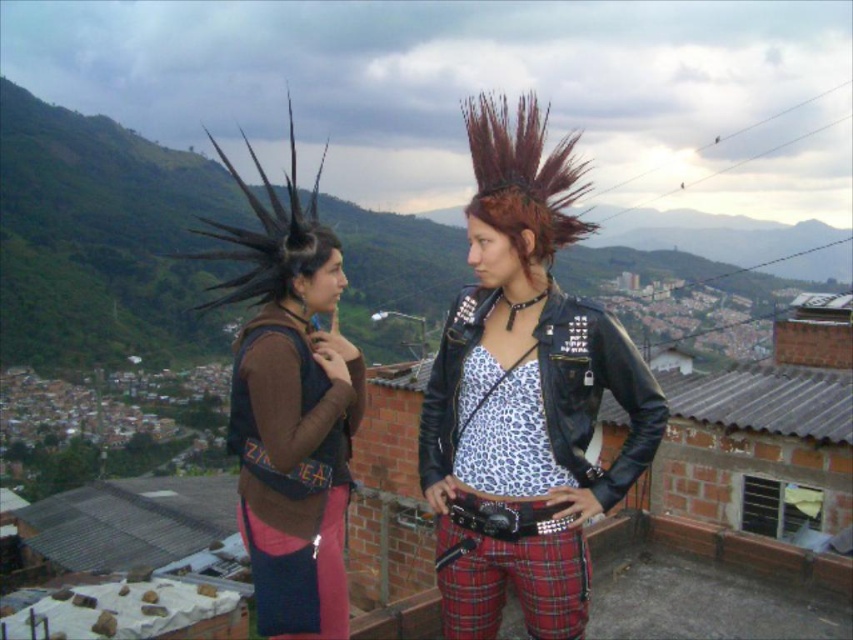
Question: Is leather jacket at center smaller than black leather jacket at center?

Choices:
 (A) yes
 (B) no

Answer: (B)

Question: Can you confirm if black leather jacket at center is positioned above dark brown mohawk at center?

Choices:
 (A) no
 (B) yes

Answer: (A)

Question: Which point appears closest to the camera in this image?

Choices:
 (A) (556, 184)
 (B) (549, 371)

Answer: (B)

Question: Which object is closer to the camera taking this photo?

Choices:
 (A) dark brown mohawk at center
 (B) black leather jacket at center
 (C) leather jacket at center

Answer: (B)

Question: Can you confirm if leather jacket at center is positioned below black leather jacket at center?

Choices:
 (A) yes
 (B) no

Answer: (B)

Question: Among these objects, which one is nearest to the camera?

Choices:
 (A) black leather jacket at center
 (B) dark brown mohawk at center

Answer: (A)